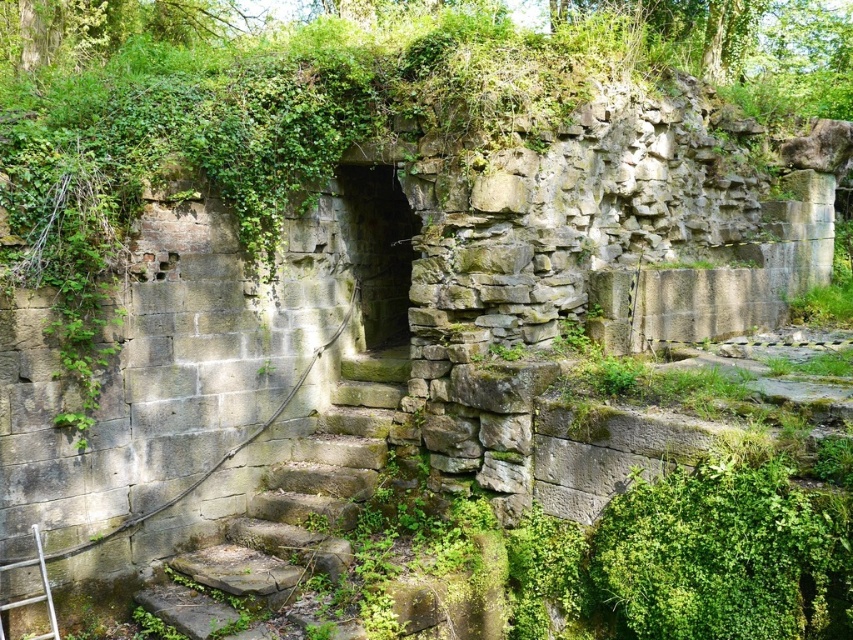
Can you confirm if stone steps at center is thinner than silver metallic ladder at lower left?

In fact, stone steps at center might be wider than silver metallic ladder at lower left.

Between stone steps at center and silver metallic ladder at lower left, which one has more height?

stone steps at center

Locate an element on the screen. The height and width of the screenshot is (640, 853). stone steps at center is located at coordinates (306, 493).

What are the coordinates of `stone steps at center` in the screenshot? It's located at (306, 493).